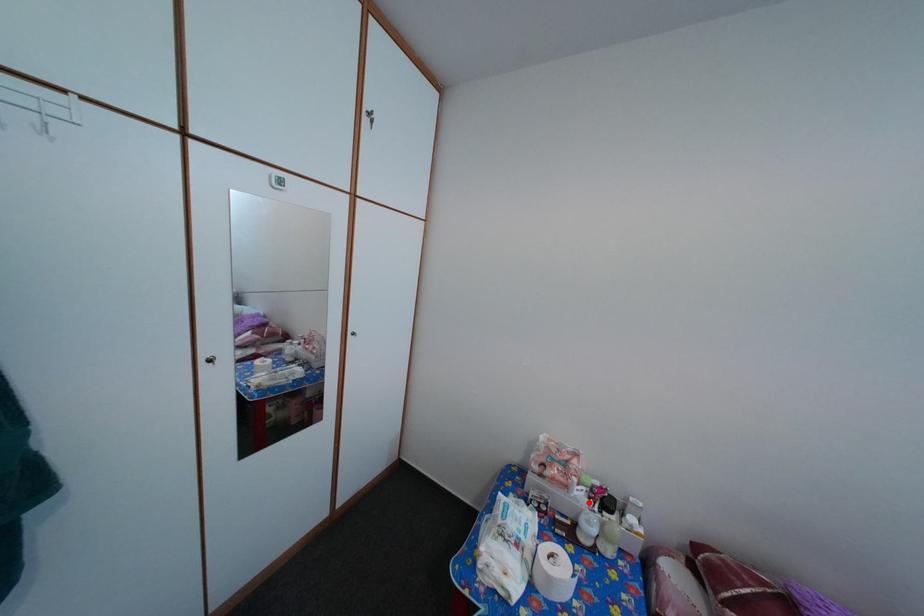
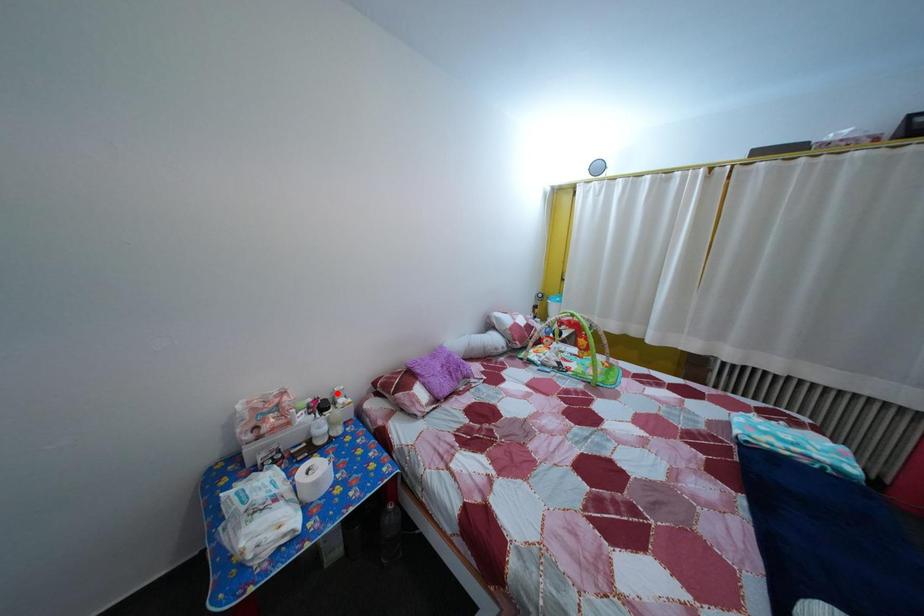
I am providing you with two images of the same scene from different viewpoints. A red point is marked on the first image and another point is marked on the second image. Are the points marked in image1 and image2 representing the same 3D position?

No